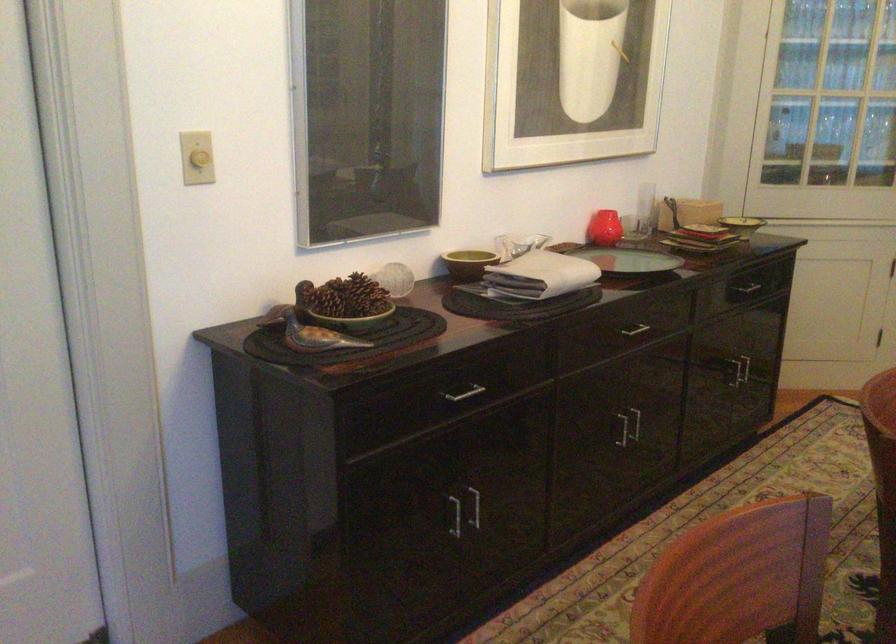
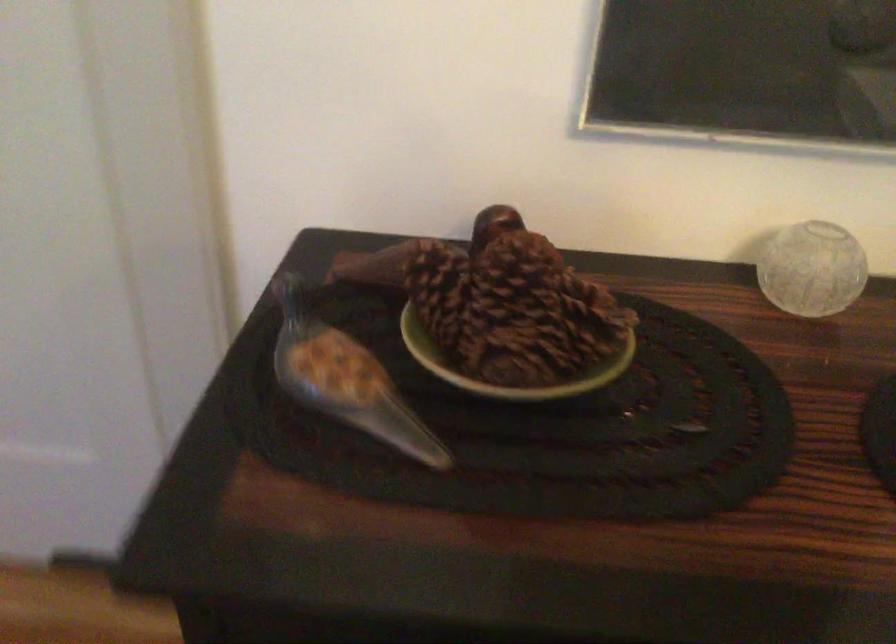
Question: I am providing you with two images of the same scene from different viewpoints. Which of the following objects are not visible in image2?

Choices:
 (A) brown pinecone
 (B) small green bowl
 (C) glass bird figurine
 (D) none of these

Answer: (D)